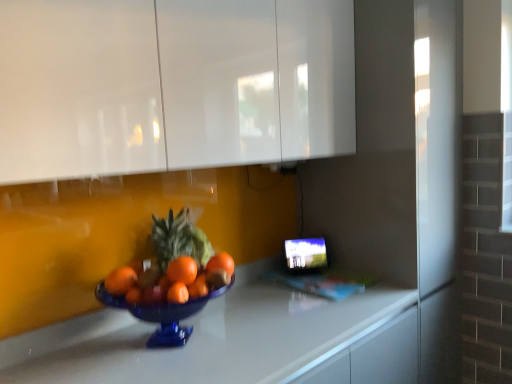
Question: From a real-world perspective, does white glossy countertop at center stand above white glossy cabinets at upper center?

Choices:
 (A) no
 (B) yes

Answer: (A)

Question: Is white glossy countertop at center not inside white glossy cabinets at upper center?

Choices:
 (A) yes
 (B) no

Answer: (A)

Question: Is white glossy countertop at center positioned in front of white glossy cabinets at upper center?

Choices:
 (A) yes
 (B) no

Answer: (A)

Question: Is white glossy countertop at center next to white glossy cabinets at upper center?

Choices:
 (A) no
 (B) yes

Answer: (A)

Question: Would you say white glossy countertop at center contains white glossy cabinets at upper center?

Choices:
 (A) no
 (B) yes

Answer: (A)

Question: Is the depth of white glossy countertop at center greater than that of white glossy cabinets at upper center?

Choices:
 (A) yes
 (B) no

Answer: (B)

Question: From a real-world perspective, is white glossy cabinets at upper center on top of white glossy countertop at center?

Choices:
 (A) yes
 (B) no

Answer: (A)

Question: From a real-world perspective, is white glossy cabinets at upper center located beneath white glossy countertop at center?

Choices:
 (A) no
 (B) yes

Answer: (A)

Question: From the image's perspective, does white glossy cabinets at upper center appear higher than white glossy countertop at center?

Choices:
 (A) yes
 (B) no

Answer: (A)

Question: Is white glossy cabinets at upper center further to camera compared to white glossy countertop at center?

Choices:
 (A) no
 (B) yes

Answer: (B)

Question: Is white glossy cabinets at upper center at the left side of white glossy countertop at center?

Choices:
 (A) no
 (B) yes

Answer: (B)

Question: Considering the relative sizes of white glossy cabinets at upper center and white glossy countertop at center in the image provided, is white glossy cabinets at upper center taller than white glossy countertop at center?

Choices:
 (A) no
 (B) yes

Answer: (B)

Question: Considering the positions of point (207, 370) and point (253, 125), is point (207, 370) closer or farther from the camera than point (253, 125)?

Choices:
 (A) farther
 (B) closer

Answer: (B)